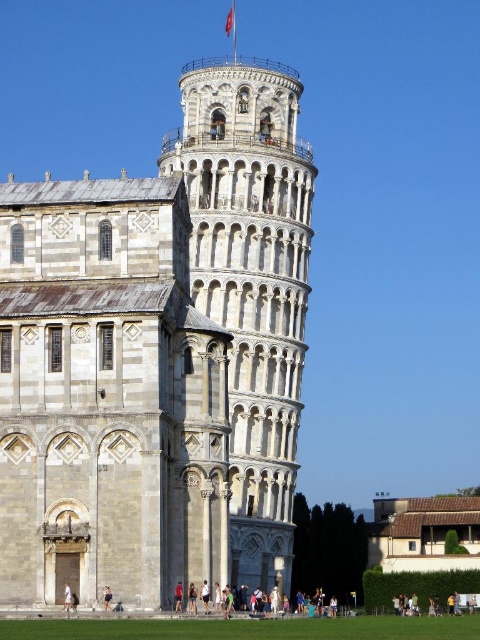
Question: Based on their relative distances, which object is nearer to the light brown wooden bench at lower center?

Choices:
 (A) white stone tower at center
 (B) skinny jeans at center
 (C) white fabric person at lower left

Answer: (C)

Question: In this image, where is white stone tower at center located relative to light brown wooden bench at lower center?

Choices:
 (A) above
 (B) below

Answer: (A)

Question: Is white fabric person at lower left thinner than skinny jeans at center?

Choices:
 (A) no
 (B) yes

Answer: (A)

Question: Which object is the closest to the white stone tower at center?

Choices:
 (A) light brown wooden bench at lower center
 (B) white fabric person at lower left

Answer: (A)

Question: Is white fabric person at lower left to the right of skinny jeans at center from the viewer's perspective?

Choices:
 (A) yes
 (B) no

Answer: (B)

Question: Which object appears farthest from the camera in this image?

Choices:
 (A) skinny jeans at center
 (B) light brown wooden bench at lower center
 (C) white stone tower at center
 (D) white fabric person at lower left

Answer: (B)